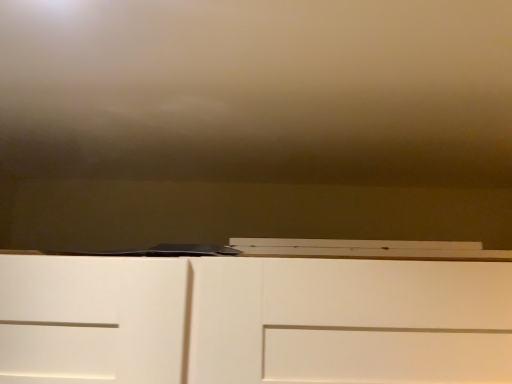
This screenshot has width=512, height=384. What do you see at coordinates (254, 121) in the screenshot?
I see `matte brown wall at upper center` at bounding box center [254, 121].

Locate an element on the screen. The height and width of the screenshot is (384, 512). matte brown wall at upper center is located at coordinates (254, 121).

What are the coordinates of `matte brown wall at upper center` in the screenshot? It's located at (254, 121).